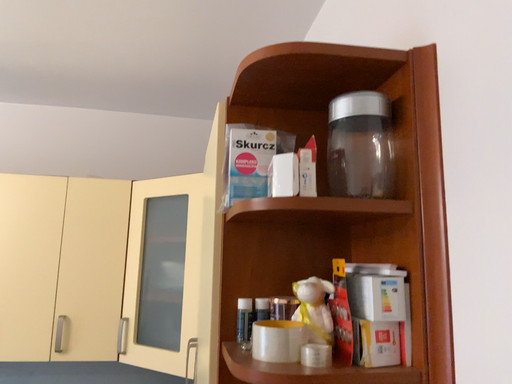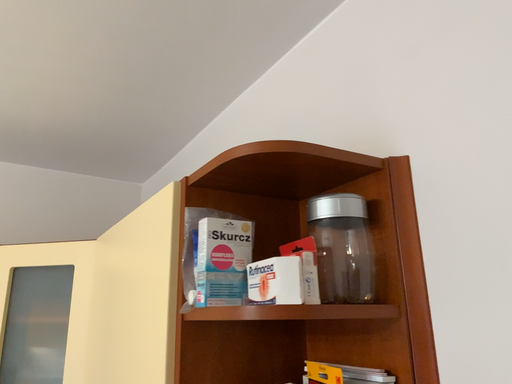
Question: How did the camera likely rotate when shooting the video?

Choices:
 (A) rotated right
 (B) rotated left

Answer: (A)